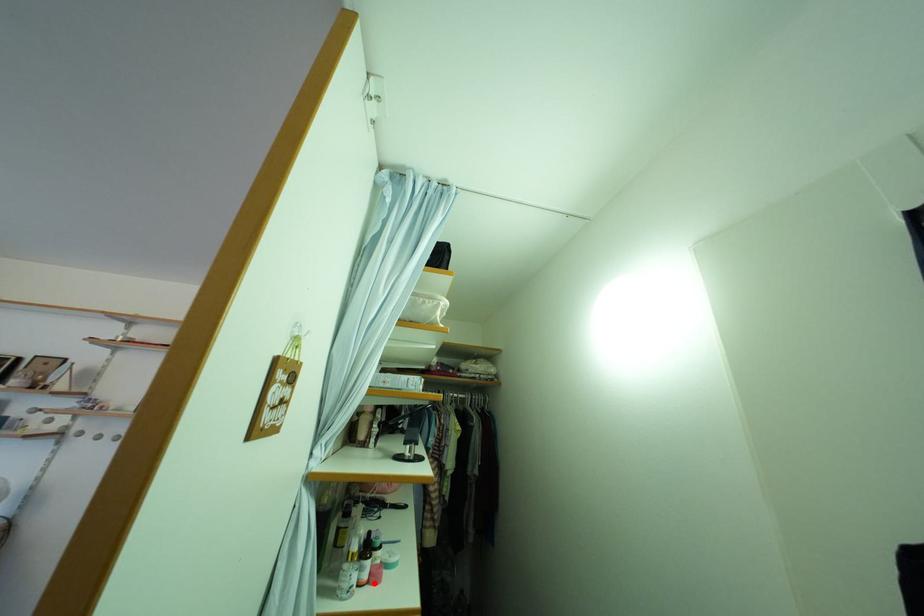
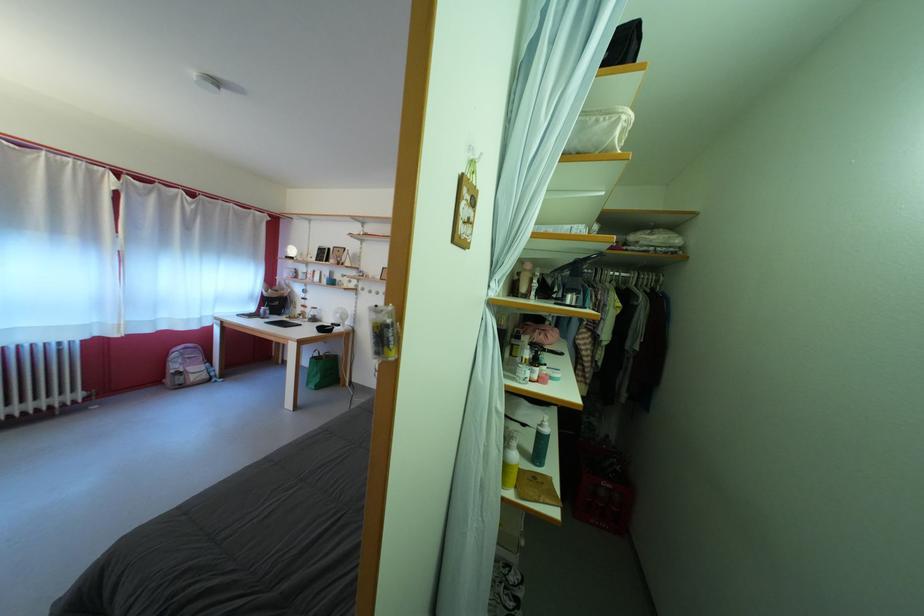
In the second image, find the point that corresponds to the highlighted location in the first image.

(543, 383)